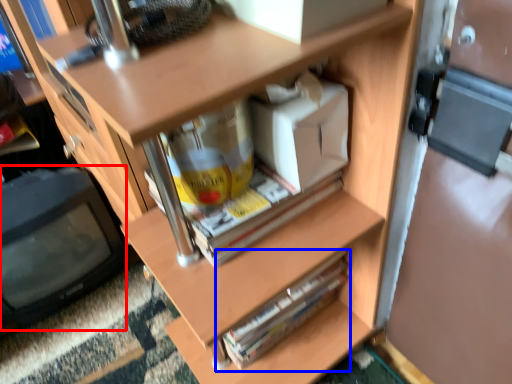
Question: Which point is further to the camera, computer monitor (highlighted by a red box) or paperback book (highlighted by a blue box)?

Choices:
 (A) computer monitor
 (B) paperback book

Answer: (A)